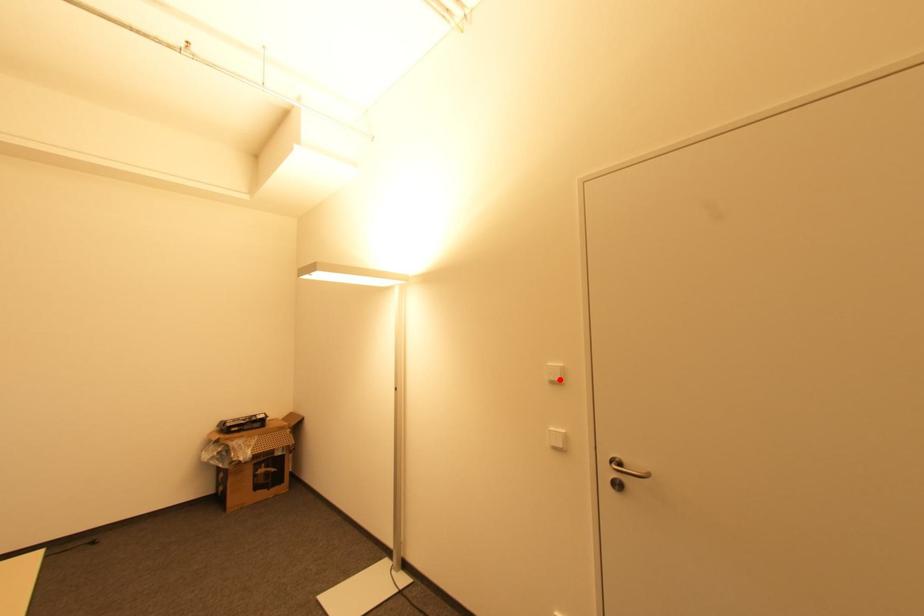
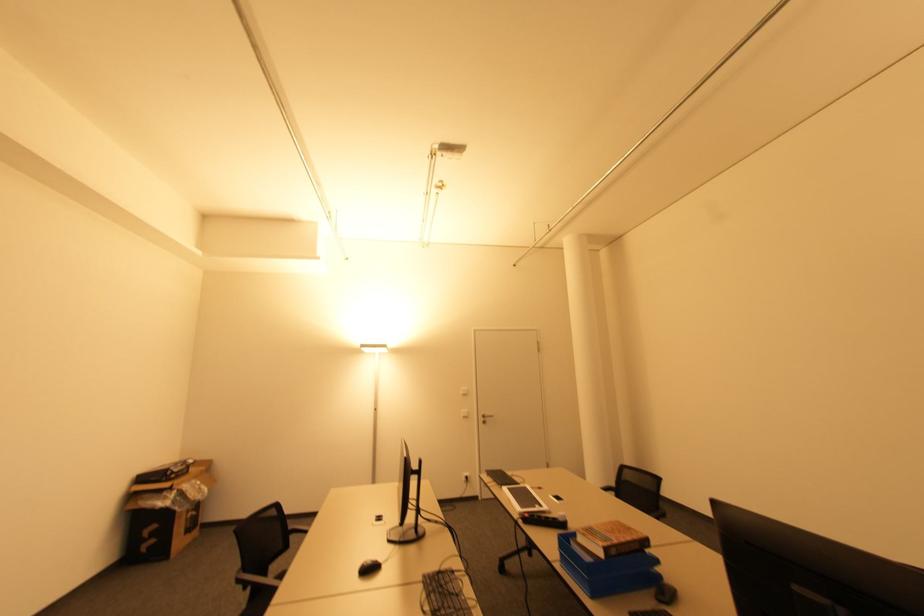
Where in the second image is the point corresponding to the highlighted location from the first image?

(468, 392)